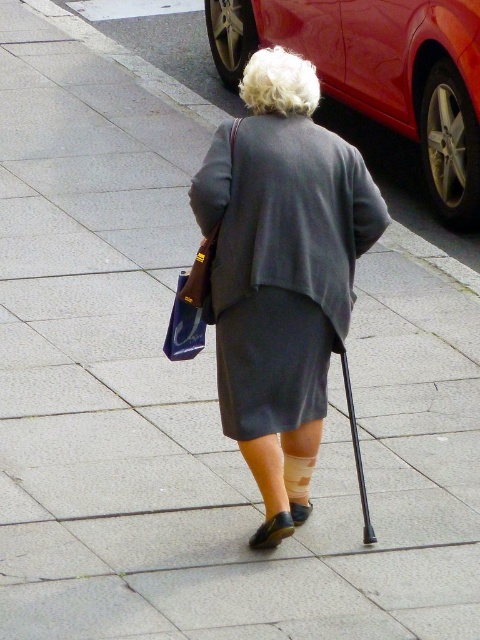
Does gray matte coat at center lie in front of blue fabric bag at center?

No, gray matte coat at center is further to the viewer.

What do you see at coordinates (280, 273) in the screenshot? The image size is (480, 640). I see `gray matte coat at center` at bounding box center [280, 273].

At what (x,y) coordinates should I click in order to perform the action: click on gray matte coat at center. Please return your answer as a coordinate pair (x, y). Looking at the image, I should click on (280, 273).

Between gray matte coat at center and shiny red car at upper right, which one appears on the right side from the viewer's perspective?

Positioned to the right is shiny red car at upper right.

What do you see at coordinates (280, 273) in the screenshot? This screenshot has width=480, height=640. I see `gray matte coat at center` at bounding box center [280, 273].

Identify the location of gray matte coat at center. (280, 273).

Who is lower down, shiny red car at upper right or blue fabric bag at center?

blue fabric bag at center

Can you confirm if shiny red car at upper right is wider than blue fabric bag at center?

Correct, the width of shiny red car at upper right exceeds that of blue fabric bag at center.

Describe the element at coordinates (380, 74) in the screenshot. I see `shiny red car at upper right` at that location.

Where is `shiny red car at upper right`? The height and width of the screenshot is (640, 480). shiny red car at upper right is located at coordinates (380, 74).